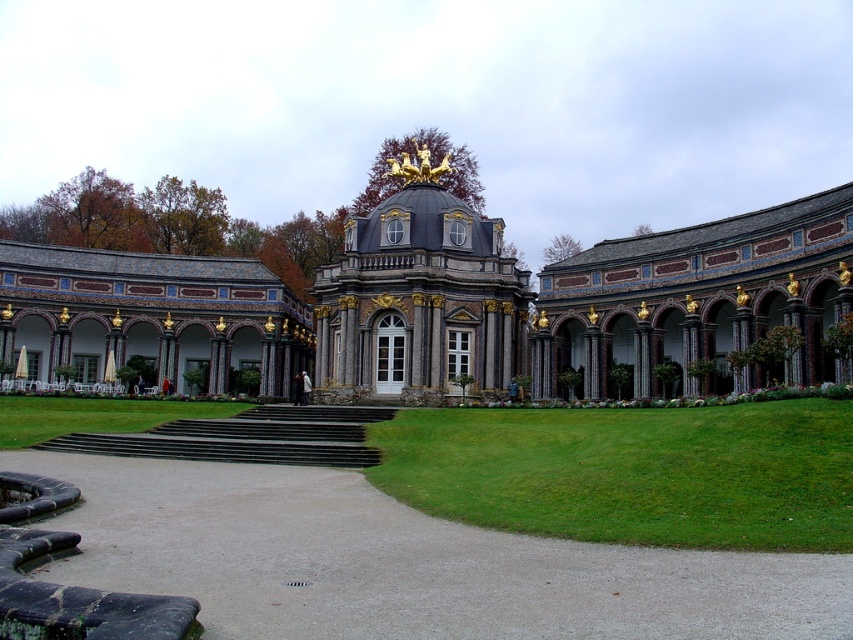
Question: Estimate the real-world distances between objects in this image. Which object is closer to the smooth concrete path at center?

Choices:
 (A) matte stone patio at lower left
 (B) green grass at center
 (C) polished stone dome at center

Answer: (B)

Question: Can you confirm if polished stone palace at center is bigger than polished stone dome at center?

Choices:
 (A) no
 (B) yes

Answer: (B)

Question: Which of the following is the farthest from the observer?

Choices:
 (A) polished stone palace at center
 (B) green grass at center
 (C) smooth concrete path at center
 (D) dark gray stone colonnade at right

Answer: (B)

Question: Is matte stone patio at lower left smaller than green grass at center?

Choices:
 (A) yes
 (B) no

Answer: (B)

Question: Is polished stone dome at center smaller than green grass at center?

Choices:
 (A) yes
 (B) no

Answer: (B)

Question: Which of the following is the farthest from the observer?

Choices:
 (A) dark gray stone colonnade at right
 (B) matte stone patio at lower left

Answer: (B)